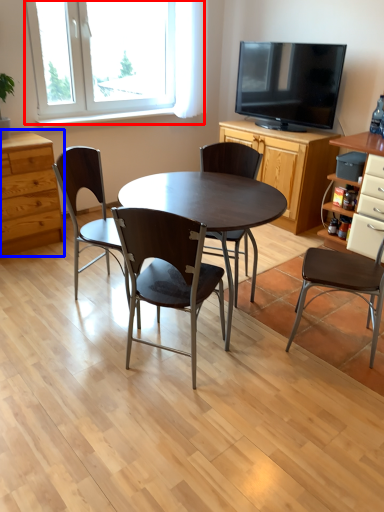
Question: Among these objects, which one is nearest to the camera, window (highlighted by a red box) or chest of drawers (highlighted by a blue box)?

Choices:
 (A) window
 (B) chest of drawers

Answer: (B)